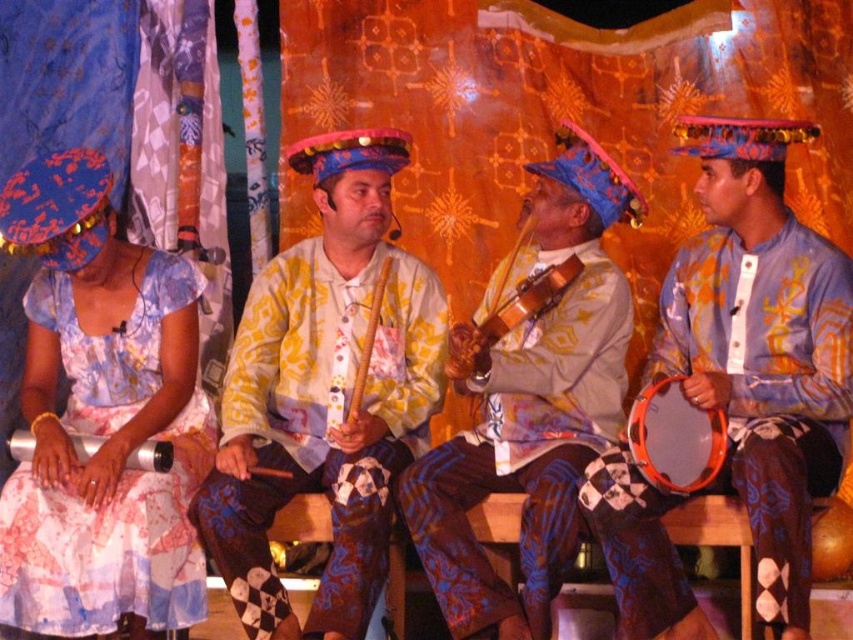
Consider the image. You are a photographer standing in front of the stage. You need to capture a closeup shot of the wooden violin at center without including the matte yellow and white shirt at center in the frame. Is this possible given their positions?

The matte yellow and white shirt at center might be wider than wooden violin at center, so there is a possibility that the shirt could block the view of the violin. To ensure the violin is fully visible without the shirt, the photographer should adjust the angle or position to avoid overlap.

You are a photographer taking a picture of the orange plastic drum at lower right and the wooden violin at center. Which object should you adjust to ensure both are centered in the frame?

The orange plastic drum at lower right is positioned on the right side of the wooden violin at center, so you should move the orange plastic drum at lower right to the left to align both objects in the center of the frame.